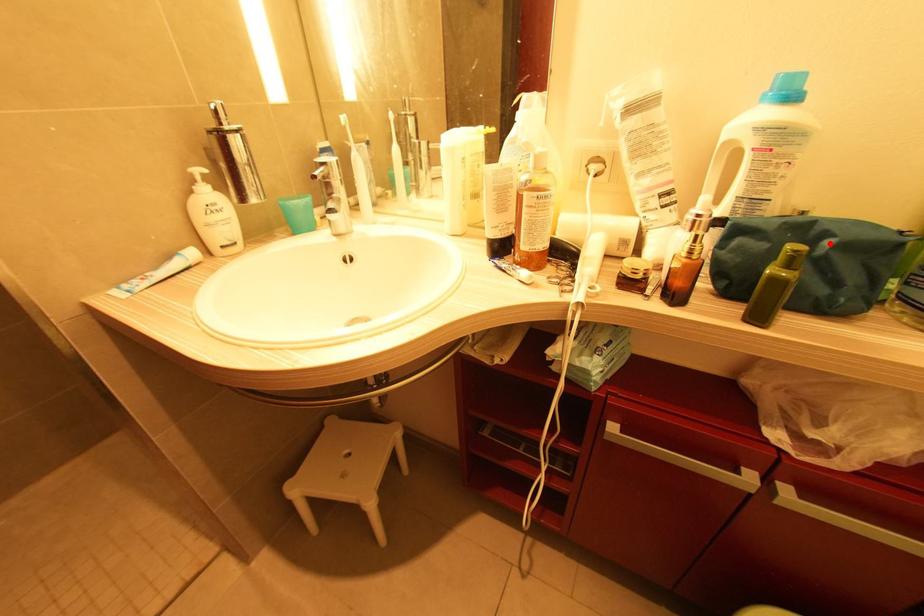
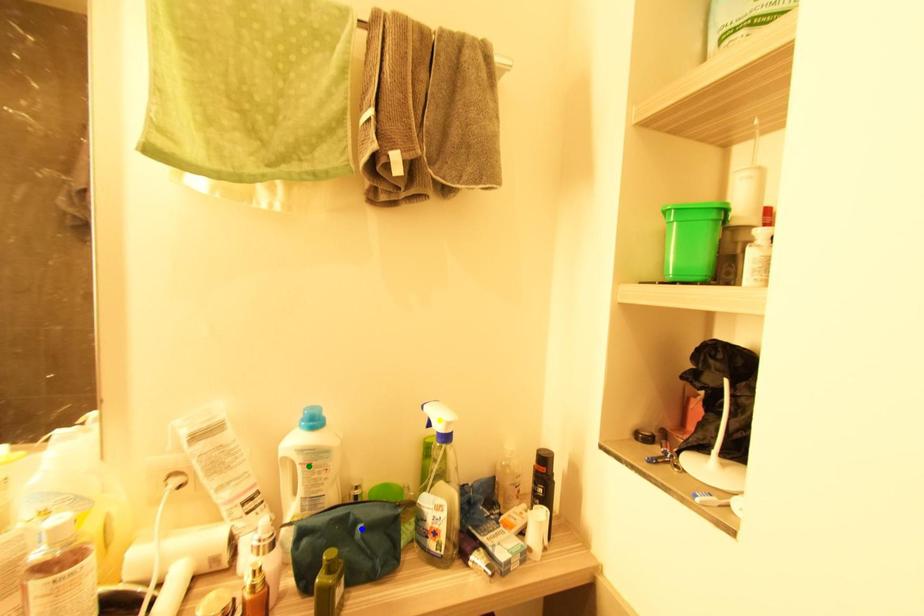
Question: I am providing you with two images of the same scene from different viewpoints. A red point is marked on the first image. You are given multiple points on the second image. Which spot in image 2 lines up with the point in image 1?

Choices:
 (A) blue point
 (B) green point
 (C) yellow point

Answer: (A)